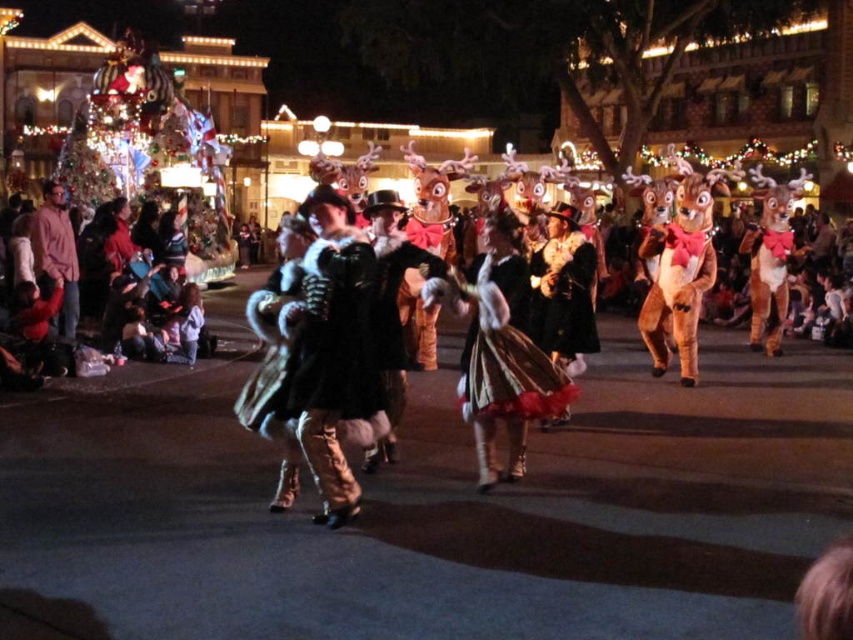
Question: Is brown plush squirrel at right above velvet gold coat at center?

Choices:
 (A) no
 (B) yes

Answer: (B)

Question: Is brown plush squirrel at right to the left of dark clothing at left from the viewer's perspective?

Choices:
 (A) yes
 (B) no

Answer: (B)

Question: Which object is positioned closest to the velvet gold dress at center?

Choices:
 (A) brown plush squirrel at right
 (B) dark clothing at left
 (C) velvet gold coat at center

Answer: (C)

Question: Which point is farther from the camera taking this photo?

Choices:
 (A) (51, 328)
 (B) (514, 396)

Answer: (A)

Question: Is brown plush squirrel at right below velvet gold coat at center?

Choices:
 (A) yes
 (B) no

Answer: (B)

Question: Which object is the closest to the brown plush squirrel at right?

Choices:
 (A) dark clothing at left
 (B) velvet gold coat at center

Answer: (B)